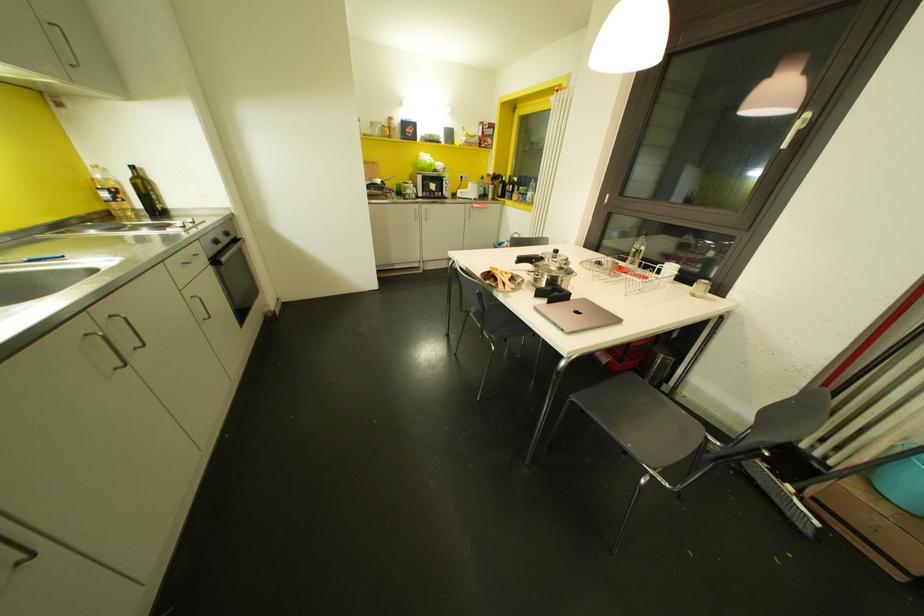
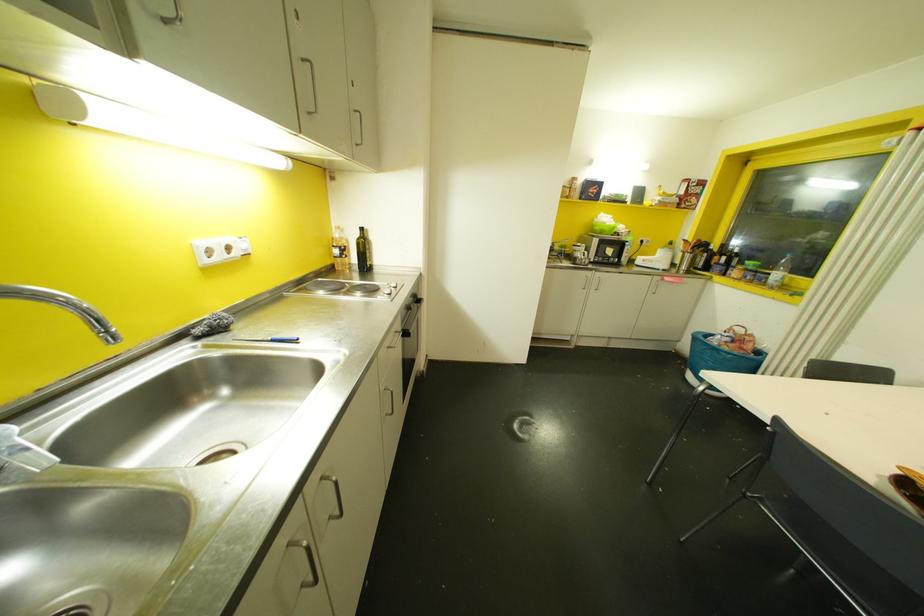
Where in the second image is the point corresponding to (x=422, y=217) from the first image?

(592, 286)